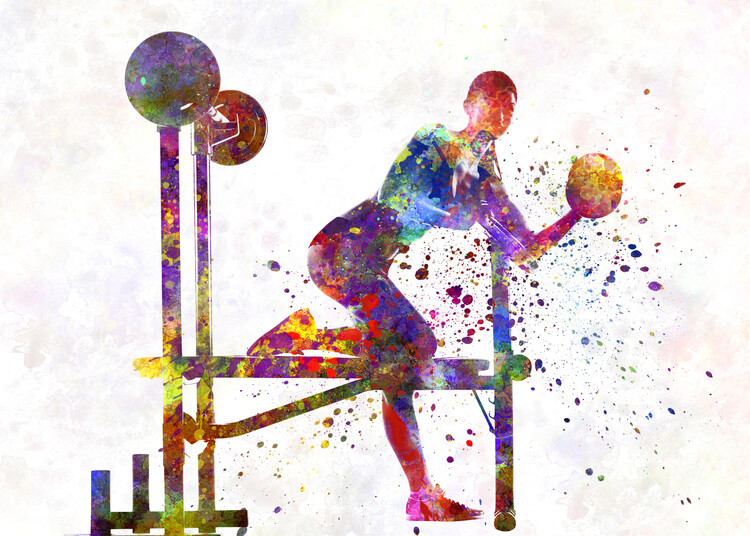
The image size is (750, 536). I want to click on workout bench, so click(284, 361).